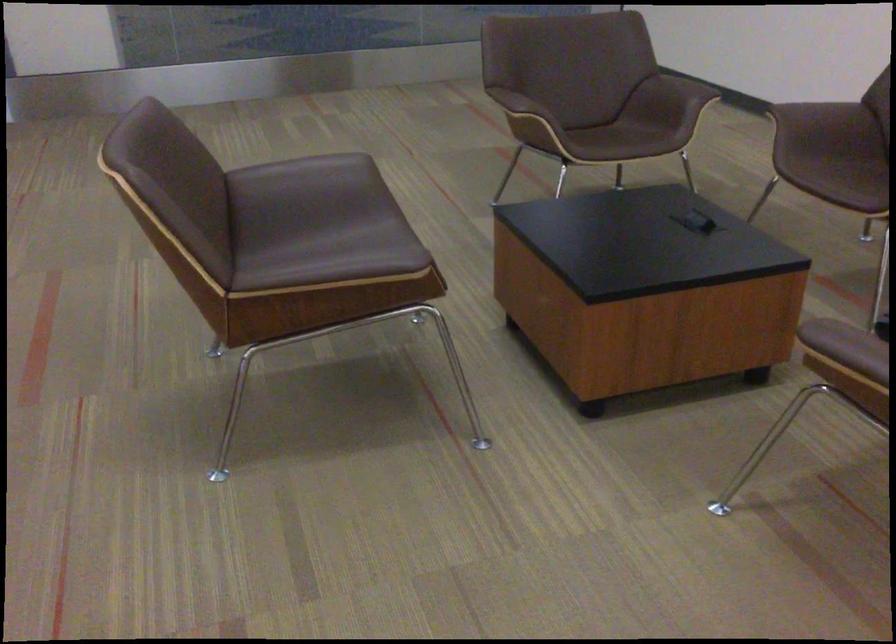
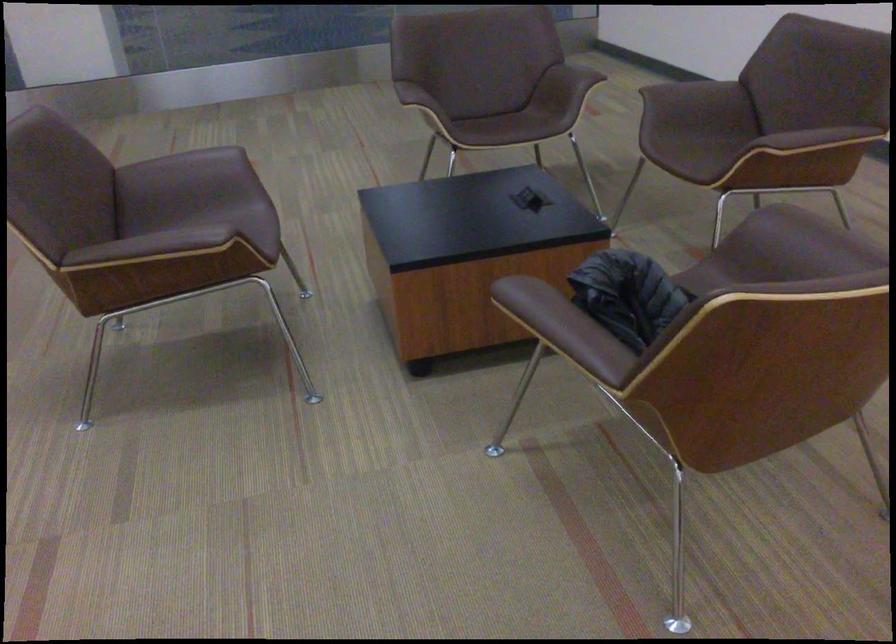
Question: Based on the continuous images, in which direction is the camera rotating? Reply with the corresponding letter.

Choices:
 (A) Left
 (B) Right
 (C) Up
 (D) Down

Answer: (A)